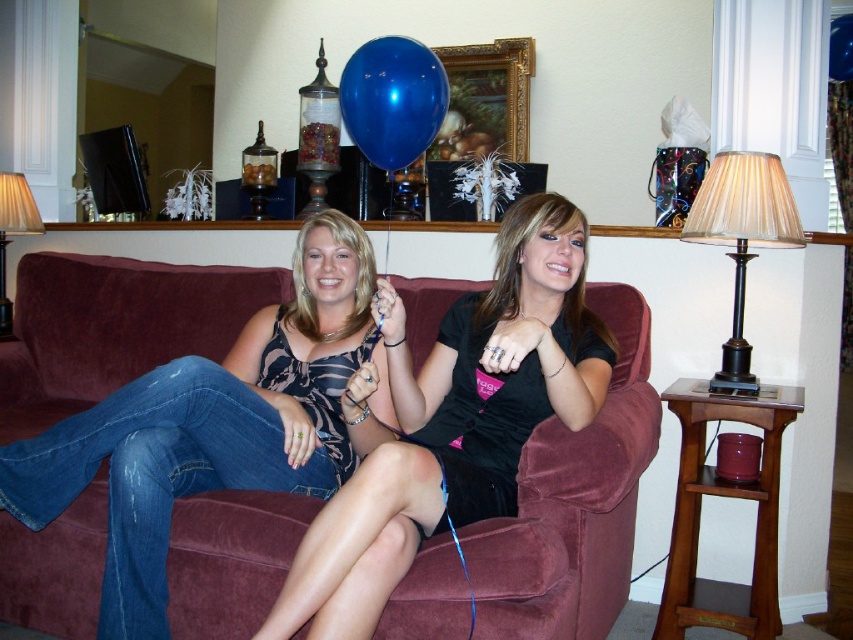
Which is more to the right, gold-framed painting at upper center or blue glossy balloon at center?

gold-framed painting at upper center

Which is behind, point (506, 161) or point (367, 136)?

Positioned behind is point (506, 161).

This screenshot has height=640, width=853. In order to click on gold-framed painting at upper center in this screenshot , I will do `click(480, 116)`.

Which is behind, point (86, 301) or point (1, 204)?

The point (1, 204) is behind.

Can you confirm if velvet maroon couch at center is wider than matte beige lampshade at upper left?

Indeed, velvet maroon couch at center has a greater width compared to matte beige lampshade at upper left.

Is point (41, 288) less distant than point (32, 227)?

Yes, point (41, 288) is closer to viewer.

Locate an element on the screen. The width and height of the screenshot is (853, 640). velvet maroon couch at center is located at coordinates (573, 502).

Who is more distant from viewer, [757,243] or [19,172]?

The point [19,172] is behind.

Is matte beige lampshade at right below matte beige lampshade at upper left?

Indeed, matte beige lampshade at right is positioned under matte beige lampshade at upper left.

What do you see at coordinates (741, 237) in the screenshot? This screenshot has width=853, height=640. I see `matte beige lampshade at right` at bounding box center [741, 237].

Locate an element on the screen. Image resolution: width=853 pixels, height=640 pixels. matte beige lampshade at right is located at coordinates (741, 237).